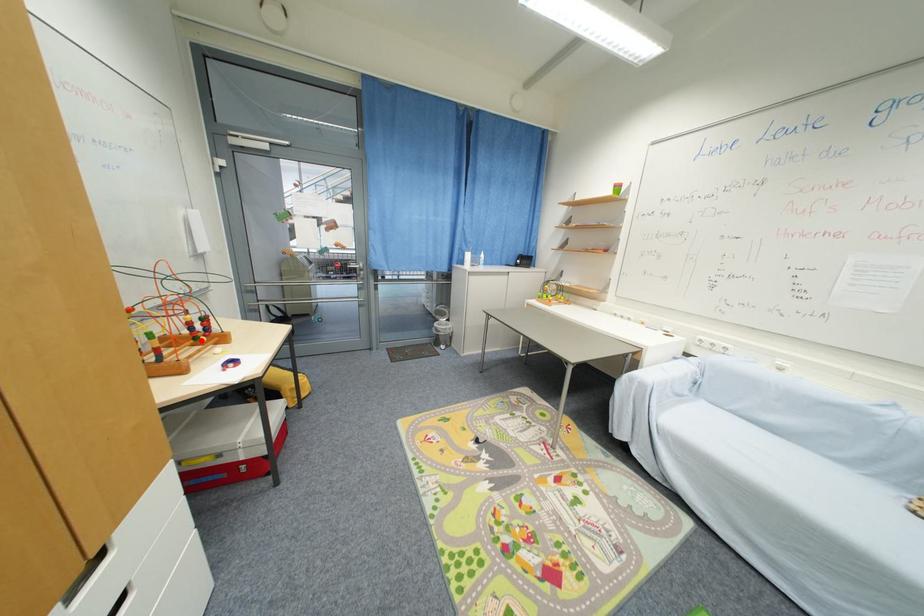
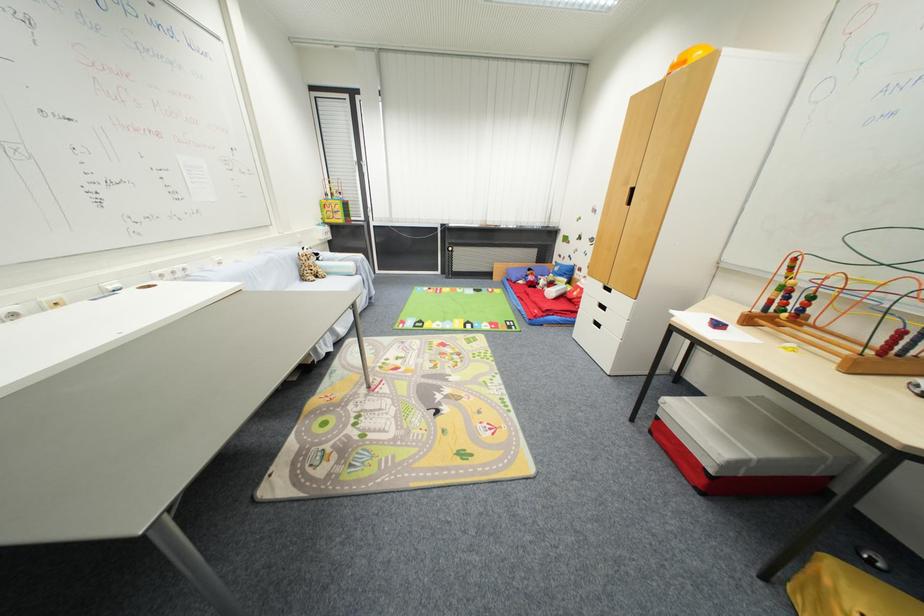
Locate, in the second image, the point that corresponds to the highlighted location in the first image.

(789, 313)